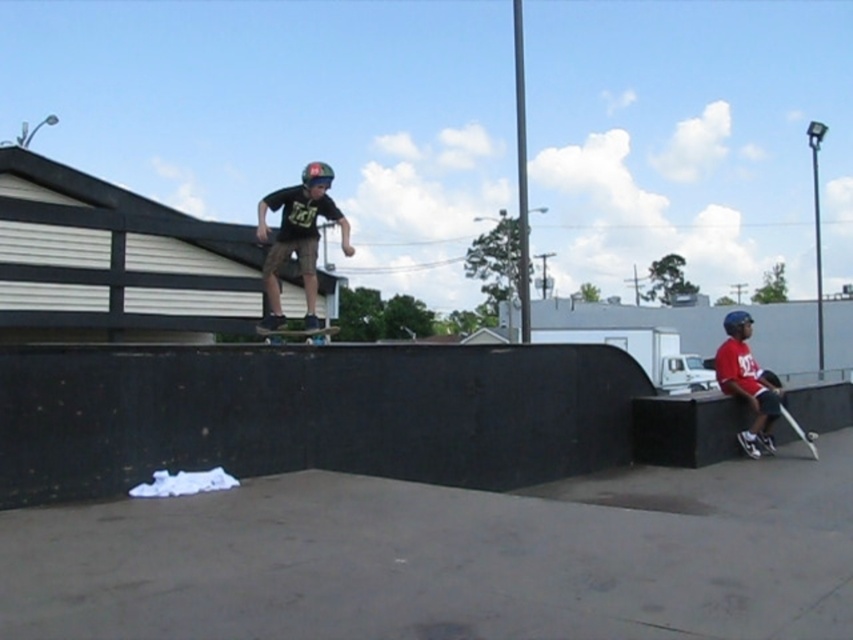
This screenshot has width=853, height=640. I want to click on black matte skateboard at center, so click(x=299, y=333).

Does point (311, 332) come closer to viewer compared to point (809, 433)?

That is True.

This screenshot has width=853, height=640. I want to click on black matte skateboard at center, so click(299, 333).

Is matte black helmet at center in front of black matte skateboard at center?

No, matte black helmet at center is further to the viewer.

Is point (288, 221) closer to viewer compared to point (273, 337)?

Yes, point (288, 221) is in front of point (273, 337).

The width and height of the screenshot is (853, 640). I want to click on matte black helmet at center, so click(299, 237).

Is matte black helmet at center wider than black matte skateboard at lower right?

Indeed, matte black helmet at center has a greater width compared to black matte skateboard at lower right.

Locate an element on the screen. The image size is (853, 640). matte black helmet at center is located at coordinates (299, 237).